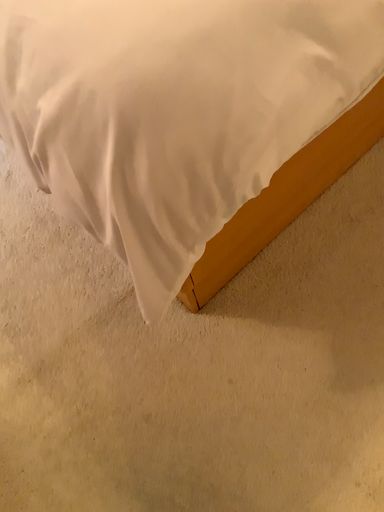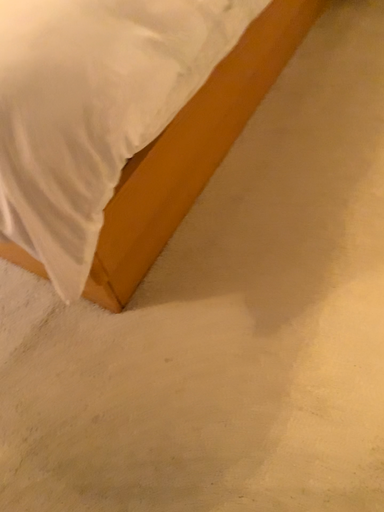
Question: How did the camera likely rotate when shooting the video?

Choices:
 (A) rotated upward
 (B) rotated downward

Answer: (A)